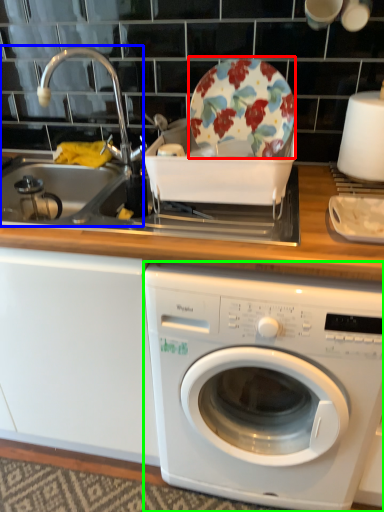
Question: Based on their relative distances, which object is farther from plate (highlighted by a red box)? Choose from sink (highlighted by a blue box) and washing machine (highlighted by a green box).

Choices:
 (A) sink
 (B) washing machine

Answer: (B)